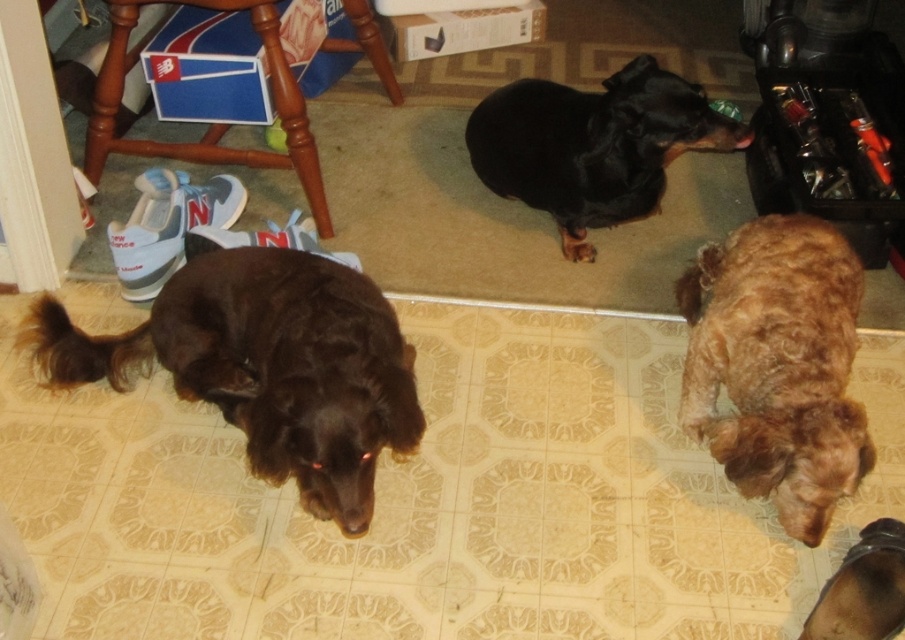
You are a photographer trying to capture a photo of the black smooth coat dog at center and the shiny brown fur at lower right. Which dog should you focus on first if you want to ensure both are in focus without adjusting the camera settings?

You should focus on the black smooth coat dog at center first because it is closer to the camera than the shiny brown fur at lower right, which is further away. By focusing on the closer subject, the background subject will still be in focus due to depth of field.

You are standing at the point labeled as point (211, 124) in the image. What object is located exactly at that point?

The point (211, 124) indicates the location of the brown wood stool at upper left.

You are a dog owner who wants to buy a new dog bed. The bed you have in mind is designed to fit medium to large sized dogs. Based on the scene description, which dog between the shiny brown fur at lower right and the black smooth coat dog at center would this bed be suitable for?

The bed is suitable for the black smooth coat dog at center because it is larger in size compared to the shiny brown fur at lower right.